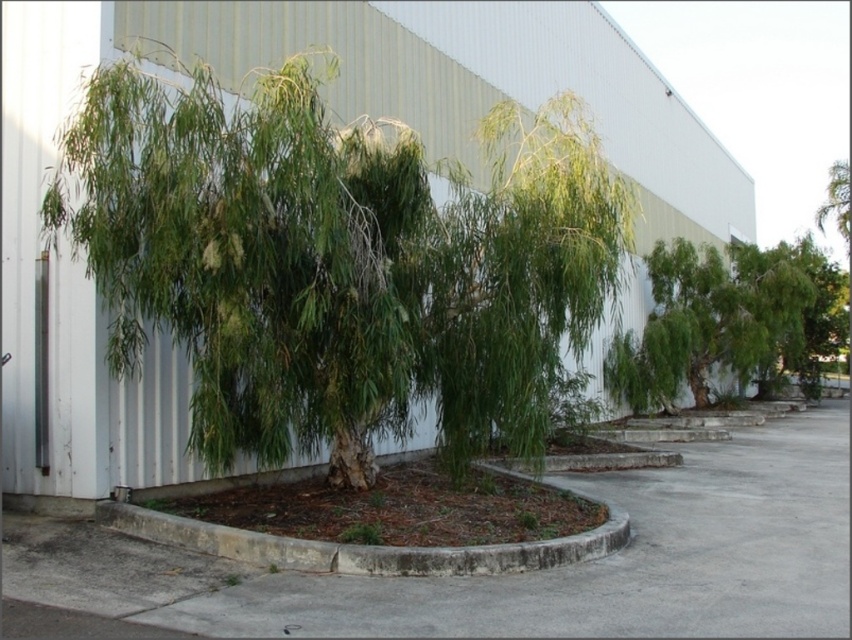
Question: Is green leafy willow at center below green leafy shrub at center?

Choices:
 (A) yes
 (B) no

Answer: (B)

Question: Which object is farther from the camera taking this photo?

Choices:
 (A) green leafy willow at center
 (B) gray concrete pavement at center
 (C) green leafy shrub at center
 (D) green leafy tree at right

Answer: (D)

Question: Can you confirm if green leafy tree at right is smaller than green leafy shrub at center?

Choices:
 (A) no
 (B) yes

Answer: (A)

Question: Does gray concrete pavement at center have a larger size compared to green leafy shrub at center?

Choices:
 (A) yes
 (B) no

Answer: (A)

Question: Considering the real-world distances, which object is farthest from the green leafy tree at right?

Choices:
 (A) green leafy shrub at center
 (B) green leafy willow at center

Answer: (B)

Question: Which of the following is the closest to the observer?

Choices:
 (A) green leafy tree at right
 (B) green leafy shrub at center
 (C) gray concrete pavement at center
 (D) green leafy willow at center

Answer: (C)